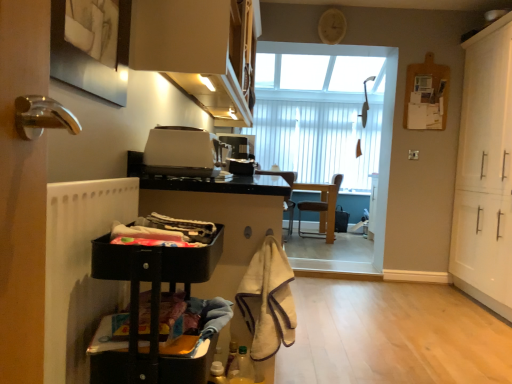
Question: Does matte white cabinet at upper center, the 2th cabinetry positioned from the right, have a larger size compared to white matte cabinet at right, the third cabinetry from the left?

Choices:
 (A) yes
 (B) no

Answer: (B)

Question: Is matte white cabinet at upper center, the 2th cabinetry positioned from the right, positioned behind white matte cabinet at right, which ranks as the 1th cabinetry in right-to-left order?

Choices:
 (A) no
 (B) yes

Answer: (A)

Question: From a real-world perspective, is matte white cabinet at upper center, the 2th cabinetry positioned from the left, over white matte cabinet at right, the third cabinetry from the left?

Choices:
 (A) no
 (B) yes

Answer: (B)

Question: Could you tell me if matte white cabinet at upper center, the 2th cabinetry positioned from the right, is turned towards white matte cabinet at right, the third cabinetry from the left?

Choices:
 (A) yes
 (B) no

Answer: (A)

Question: From the image's perspective, is matte white cabinet at upper center, the 2th cabinetry positioned from the right, beneath white matte cabinet at right, which ranks as the 1th cabinetry in right-to-left order?

Choices:
 (A) no
 (B) yes

Answer: (A)

Question: In terms of width, does beige fuzzy towel at lower center look wider or thinner when compared to white matte cabinet at right, the third cabinetry from the left?

Choices:
 (A) wide
 (B) thin

Answer: (B)

Question: Is beige fuzzy towel at lower center taller or shorter than white matte cabinet at right, the third cabinetry from the left?

Choices:
 (A) tall
 (B) short

Answer: (B)

Question: Choose the correct answer: Is beige fuzzy towel at lower center inside white matte cabinet at right, the third cabinetry from the left, or outside it?

Choices:
 (A) inside
 (B) outside

Answer: (B)

Question: From the image's perspective, is beige fuzzy towel at lower center positioned above or below white matte cabinet at right, which ranks as the 1th cabinetry in right-to-left order?

Choices:
 (A) above
 (B) below

Answer: (B)

Question: Relative to brown leather chair at center, the 2th chair in the right-to-left sequence, is plastic basket at lower left, the second laundry positioned from the top, in front or behind?

Choices:
 (A) front
 (B) behind

Answer: (A)

Question: From a real-world perspective, is plastic basket at lower left, which is counted as the first laundry, starting from the bottom, physically located above or below brown leather chair at center, the 2th chair in the right-to-left sequence?

Choices:
 (A) below
 (B) above

Answer: (B)

Question: Would you say plastic basket at lower left, which is counted as the first laundry, starting from the bottom, is inside or outside brown leather chair at center, the 2th chair in the right-to-left sequence?

Choices:
 (A) outside
 (B) inside

Answer: (A)

Question: Considering the positions of plastic basket at lower left, the second laundry positioned from the top, and brown leather chair at center, the 2th chair in the right-to-left sequence, in the image, is plastic basket at lower left, the second laundry positioned from the top, wider or thinner than brown leather chair at center, the 2th chair in the right-to-left sequence,?

Choices:
 (A) thin
 (B) wide

Answer: (A)

Question: Is satin black toaster at center, acting as the first appliance starting from the back, inside the boundaries of matte black laundry basket at lower left, arranged as the 2th laundry when ordered from the bottom, or outside?

Choices:
 (A) inside
 (B) outside

Answer: (B)

Question: Does point (245, 160) appear closer or farther from the camera than point (120, 236)?

Choices:
 (A) closer
 (B) farther

Answer: (B)